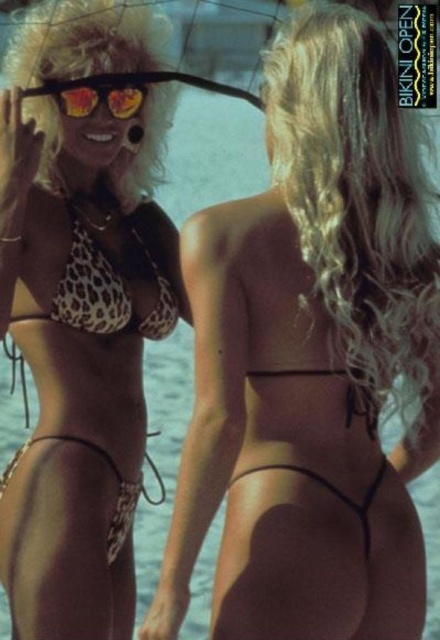
You are a photographer trying to capture both the leopard print bikini at left and the leopard print bikini top at upper left in a single frame. Given their widths, which one should you focus on to ensure both fit comfortably in the shot?

The leopard print bikini at left is wider than the leopard print bikini top at upper left, so focusing on the leopard print bikini at left will ensure both fit comfortably in the shot.

You are a photographer trying to capture a closeup of both the leopard print bikini at left and the shiny orange sunglasses at upper left. Since you want to ensure both are in focus, which object should you adjust your camera focus on first, the one closer to you or the one further away?

The leopard print bikini at left has a greater height compared to the shiny orange sunglasses at upper left, so the leopard print bikini at left is closer to you. Therefore, you should focus on the leopard print bikini at left first to ensure both are in focus.